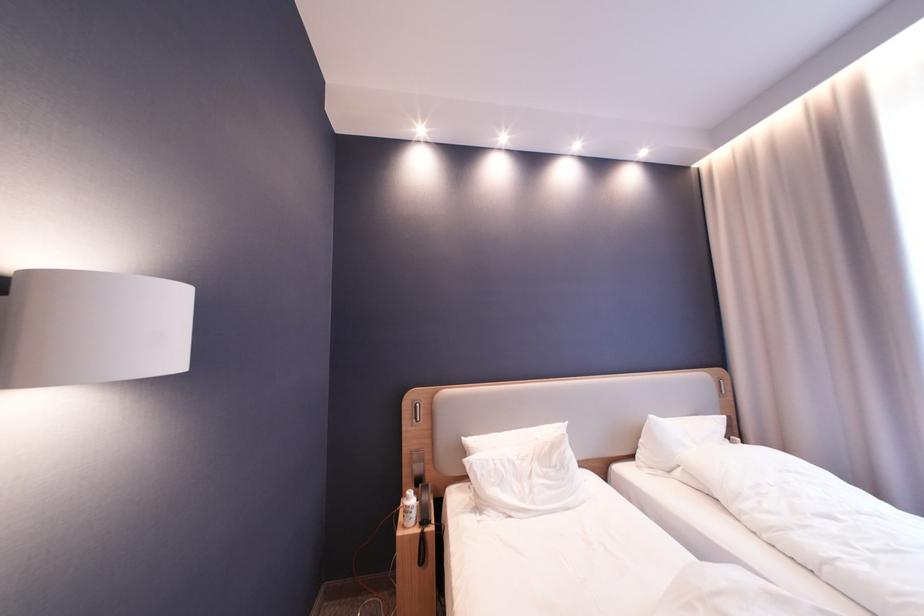
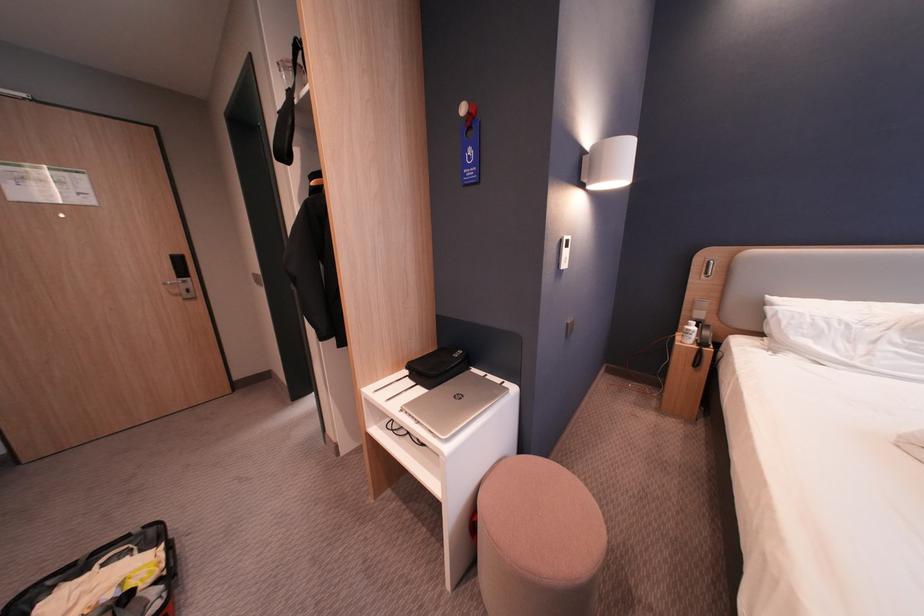
First-person continuous shooting, in which direction is the camera rotating?

The rotation direction of the camera is left-down.